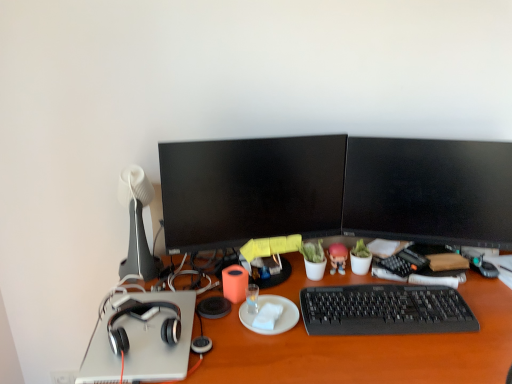
Locate an element on the screen. This screenshot has height=384, width=512. free space that is to the left of black matte keyboard at lower right is located at coordinates (271, 337).